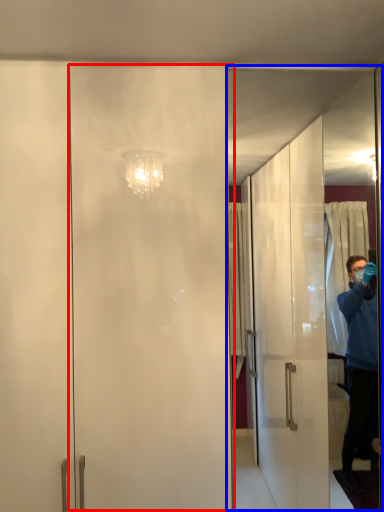
Question: Among these objects, which one is nearest to the camera, screen door (highlighted by a red box) or screen door (highlighted by a blue box)?

Choices:
 (A) screen door
 (B) screen door

Answer: (A)